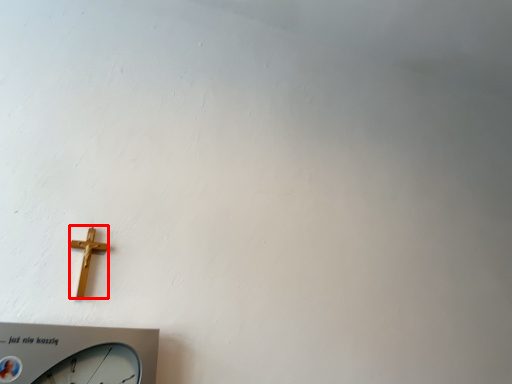
Question: Where is crucifix (annotated by the red box) located in relation to wall clock in the image?

Choices:
 (A) right
 (B) left

Answer: (B)